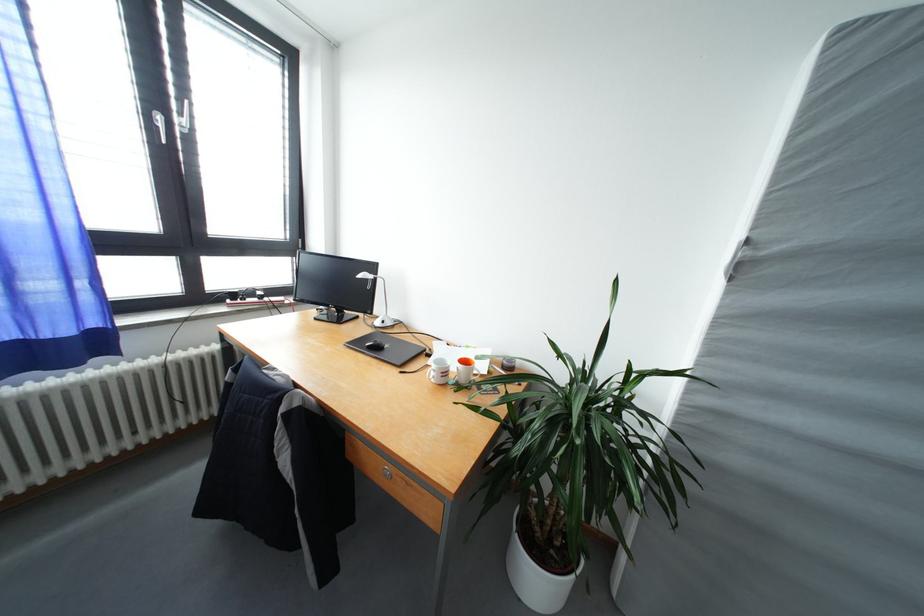
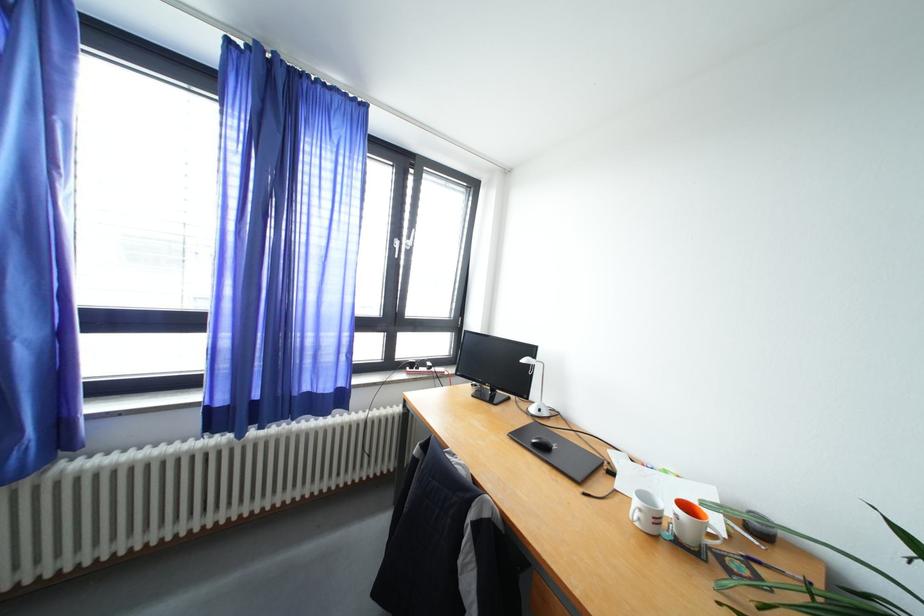
Find the pixel in the second image that matches point (377, 353) in the first image.

(541, 450)